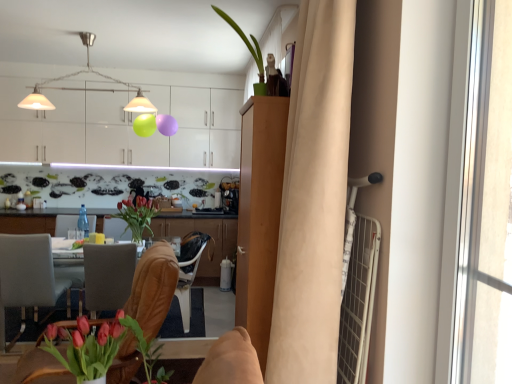
Question: Is white glossy cabinets at upper center, the third cabinetry in the front-to-back sequence, inside matte pink tulips in vase at lower left, the 2th floral arrangement from the back?

Choices:
 (A) yes
 (B) no

Answer: (B)

Question: From a real-world perspective, is matte pink tulips in vase at lower left, the 2th floral arrangement from the back, physically above white glossy cabinets at upper center, the third cabinetry in the front-to-back sequence?

Choices:
 (A) no
 (B) yes

Answer: (A)

Question: From a real-world perspective, is matte pink tulips in vase at lower left, positioned as the second floral arrangement in top-to-bottom order, below white glossy cabinets at upper center, the third cabinetry in the front-to-back sequence?

Choices:
 (A) no
 (B) yes

Answer: (B)

Question: Is matte pink tulips in vase at lower left, the 2th floral arrangement from the back, facing towards white glossy cabinets at upper center, the third cabinetry in the front-to-back sequence?

Choices:
 (A) no
 (B) yes

Answer: (A)

Question: From the image's perspective, does matte pink tulips in vase at lower left, which appears as the 1th floral arrangement when ordered from the bottom, appear lower than white glossy cabinets at upper center, arranged as the first cabinetry when viewed from the back?

Choices:
 (A) no
 (B) yes

Answer: (B)

Question: From their relative heights in the image, would you say matte glass vase at center, the 2th floral arrangement when ordered from bottom to top, is taller or shorter than green matte plant at lower center?

Choices:
 (A) tall
 (B) short

Answer: (A)

Question: Considering their positions, is matte glass vase at center, acting as the 2th floral arrangement starting from the front, located in front of or behind green matte plant at lower center?

Choices:
 (A) behind
 (B) front

Answer: (A)

Question: Looking at their shapes, would you say matte glass vase at center, the 2th floral arrangement when ordered from bottom to top, is wider or thinner than green matte plant at lower center?

Choices:
 (A) wide
 (B) thin

Answer: (A)

Question: Is point (140, 220) positioned closer to the camera than point (169, 375)?

Choices:
 (A) farther
 (B) closer

Answer: (A)

Question: Does point (138, 329) appear closer or farther from the camera than point (39, 84)?

Choices:
 (A) farther
 (B) closer

Answer: (B)

Question: Choose the correct answer: Is green matte plant at lower center inside metallic pendant lights at upper center or outside it?

Choices:
 (A) outside
 (B) inside

Answer: (A)

Question: From a real-world perspective, is green matte plant at lower center above or below metallic pendant lights at upper center?

Choices:
 (A) above
 (B) below

Answer: (B)

Question: Visually, is green matte plant at lower center positioned to the left or to the right of metallic pendant lights at upper center?

Choices:
 (A) right
 (B) left

Answer: (A)

Question: Is matte glass vase at center, positioned as the 2th floral arrangement in right-to-left order, spatially inside light brown wood cabinet at center, the 3th cabinetry from the back, or outside of it?

Choices:
 (A) inside
 (B) outside

Answer: (B)

Question: In terms of size, does matte glass vase at center, the 2th floral arrangement when ordered from bottom to top, appear bigger or smaller than light brown wood cabinet at center, acting as the 1th cabinetry starting from the front?

Choices:
 (A) small
 (B) big

Answer: (A)